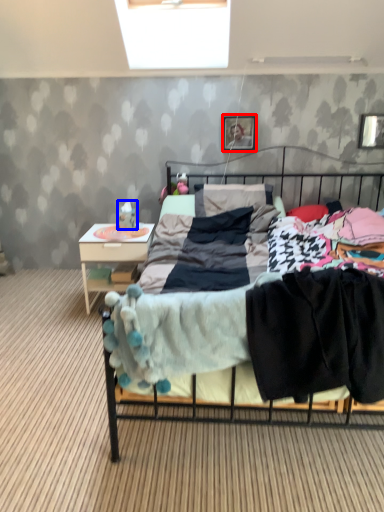
Question: Which object is further to the camera taking this photo, picture frame (highlighted by a red box) or toy (highlighted by a blue box)?

Choices:
 (A) picture frame
 (B) toy

Answer: (A)